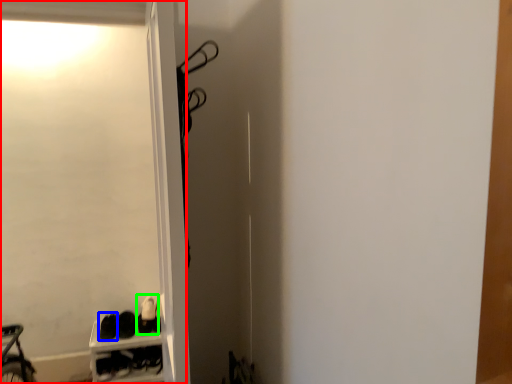
Question: Based on their relative distances, which object is nearer to screen door (highlighted by a red box)? Choose from footwear (highlighted by a blue box) and footwear (highlighted by a green box).

Choices:
 (A) footwear
 (B) footwear

Answer: (B)